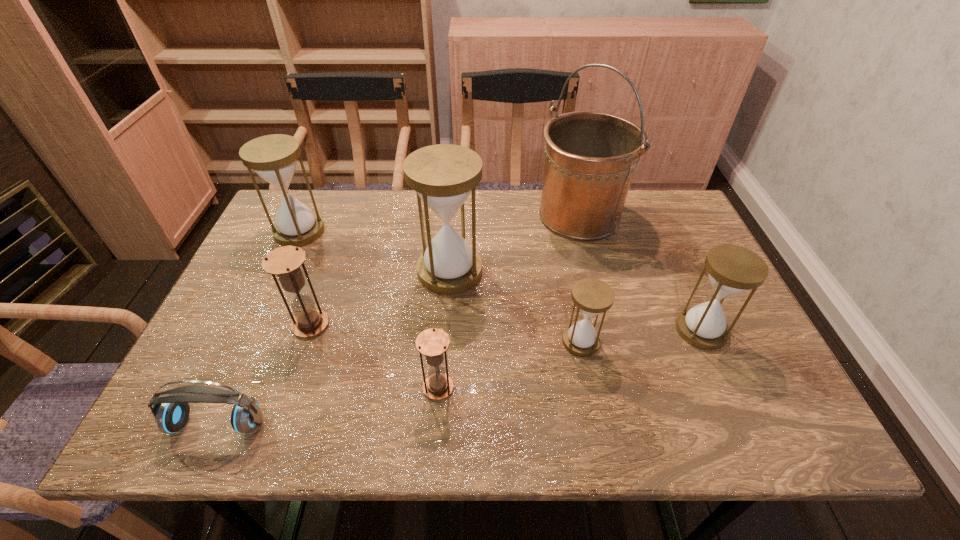
At what (x,y) coordinates should I click in order to perform the action: click on vacant area that lies between the nearest object and the leftmost white hourglass. Please return your answer as a coordinate pair (x, y). The image size is (960, 540). Looking at the image, I should click on (258, 328).

Find the location of a particular element. The width and height of the screenshot is (960, 540). vacant space that is in between the rightmost object and the leftmost hourglass is located at coordinates (500, 281).

You are a GUI agent. You are given a task and a screenshot of the screen. Output one action in this format:
    pyautogui.click(x=<x>, y=<y>)
    Task: Click on the free space between the rightmost object and the bucket
    The image size is (960, 540).
    Given the screenshot: What is the action you would take?
    pyautogui.click(x=640, y=273)

Locate which object ranks fourth in proximity to the nearer brown hourglass. Please provide its 2D coordinates. Your answer should be formatted as a tuple, i.e. [(x, y)], where the tuple contains the x and y coordinates of a point satisfying the conditions above.

[(171, 416)]

Where is `object that is the seventh closest to the smallest white hourglass`? Image resolution: width=960 pixels, height=540 pixels. object that is the seventh closest to the smallest white hourglass is located at coordinates (273, 157).

Where is `hourglass object that ranks as the closest to the nearest object`? Image resolution: width=960 pixels, height=540 pixels. hourglass object that ranks as the closest to the nearest object is located at coordinates (x=285, y=262).

Identify the location of hourglass object that ranks as the fourth closest to the farthest hourglass. (591, 296).

You are a GUI agent. You are given a task and a screenshot of the screen. Output one action in this format:
    pyautogui.click(x=<x>, y=<y>)
    Task: Click on the white hourglass that can be found as the closest to the farthest white hourglass
    Image resolution: width=960 pixels, height=540 pixels.
    Given the screenshot: What is the action you would take?
    pyautogui.click(x=443, y=175)

Image resolution: width=960 pixels, height=540 pixels. I want to click on the second closest white hourglass relative to the leftmost hourglass, so (591, 296).